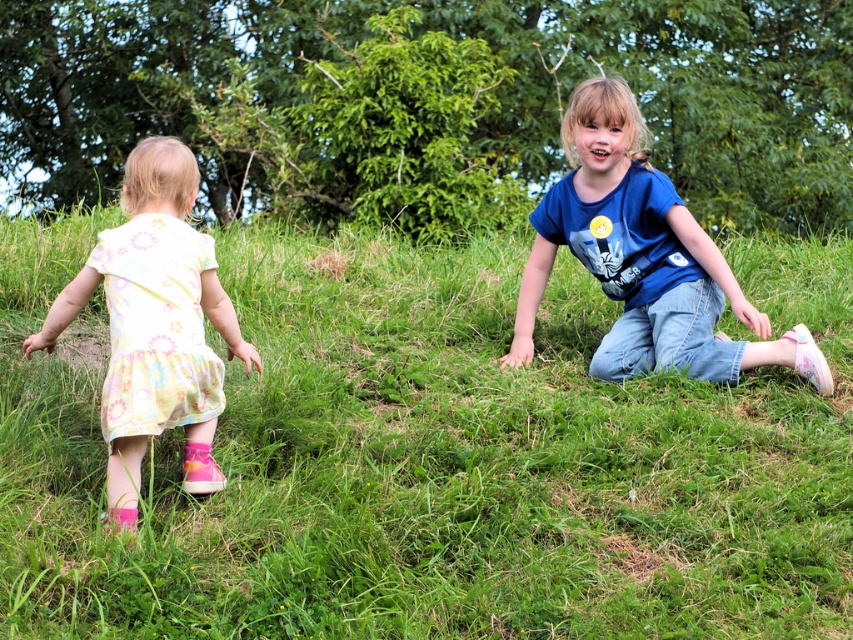
Looking at this image, you are a photographer trying to capture a photo of the two children. You want to ensure the pastel floral dress at left and the green grass at center are both in focus. Based on their positions, which object is closer to the camera? Explain your reasoning.

The pastel floral dress at left is closer to the camera than the green grass at center because the green grass at center is positioned to the right of the pastel floral dress at left, indicating it is further away in the scene.

You are a photographer trying to capture both the blue cotton shirt at center and the pastel floral dress at left in a single frame. Based on their positions, which object is positioned closer to the camera?

The blue cotton shirt at center is positioned closer to the camera than the pastel floral dress at left because it is wider in the frame, indicating it is nearer according to perspective.